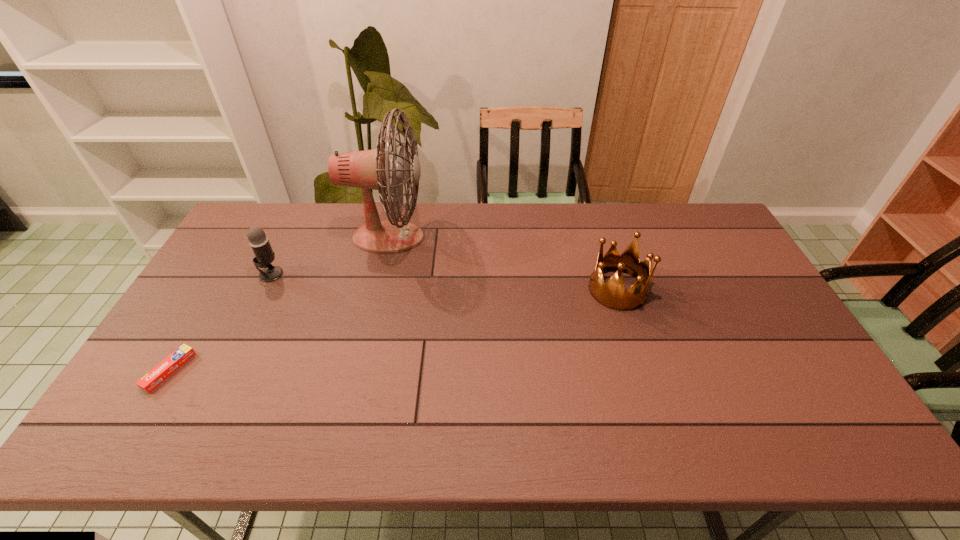
Locate an element on the screen. The height and width of the screenshot is (540, 960). the second object from right to left is located at coordinates (370, 169).

Find the location of a particular element. This screenshot has height=540, width=960. fan is located at coordinates (370, 169).

Where is `the second object from left to right`? The height and width of the screenshot is (540, 960). the second object from left to right is located at coordinates (264, 256).

Where is `crown`? The image size is (960, 540). crown is located at coordinates (612, 295).

Locate an element on the screen. This screenshot has height=540, width=960. toothpaste is located at coordinates (168, 366).

This screenshot has height=540, width=960. What are the coordinates of `the leftmost object` in the screenshot? It's located at (168, 366).

Where is `vacant space situated 0.320m in front of the fan to direct airflow`? vacant space situated 0.320m in front of the fan to direct airflow is located at coordinates (520, 238).

Where is `free location located 0.230m on the back of the second object from left to right`? The image size is (960, 540). free location located 0.230m on the back of the second object from left to right is located at coordinates (297, 222).

The image size is (960, 540). I want to click on free space located on the back of the rightmost object, so click(x=592, y=210).

Locate an element on the screen. The width and height of the screenshot is (960, 540). vacant space located on the back of the leftmost object is located at coordinates (206, 308).